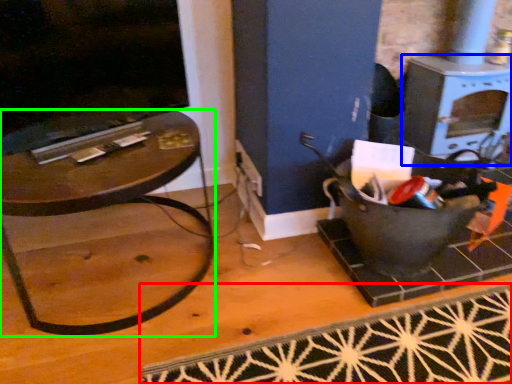
Question: Considering the real-world distances, which object is farthest from doormat (highlighted by a red box)? stove (highlighted by a blue box) or table (highlighted by a green box)?

Choices:
 (A) stove
 (B) table

Answer: (A)